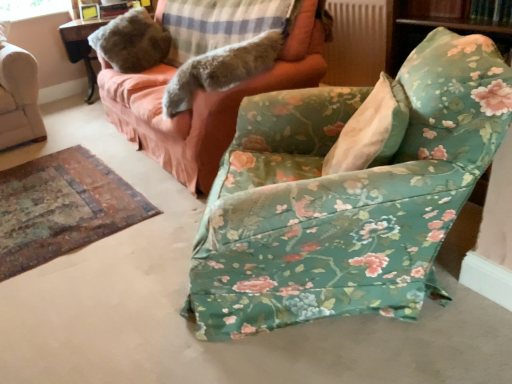
Question: From a real-world perspective, is floral fabric chair at center physically located above or below fuzzy fabric pillow at upper left, placed as the third pillow when sorted from front to back?

Choices:
 (A) above
 (B) below

Answer: (B)

Question: Visually, is floral fabric chair at center positioned to the left or to the right of fuzzy fabric pillow at upper left, marked as the 1th pillow in a back-to-front arrangement?

Choices:
 (A) left
 (B) right

Answer: (B)

Question: Which is farther from the fluffy gray pillow at upper center, positioned as the 2th pillow in back-to-front order?

Choices:
 (A) fluffy gray fur at upper center
 (B) white fabric pillow at center, the 3th pillow viewed from the back
 (C) clear glass window screen at upper left
 (D) floral fabric chair at center
 (E) fuzzy fabric pillow at upper left, placed as the third pillow when sorted from front to back

Answer: (C)

Question: Which object is positioned farthest from the floral fabric chair at center?

Choices:
 (A) white fabric pillow at center, acting as the first pillow starting from the front
 (B) floral fabric couch at upper center
 (C) fuzzy fabric pillow at upper left, placed as the third pillow when sorted from front to back
 (D) clear glass window screen at upper left
 (E) fluffy gray pillow at upper center, arranged as the second pillow when viewed from the front

Answer: (D)